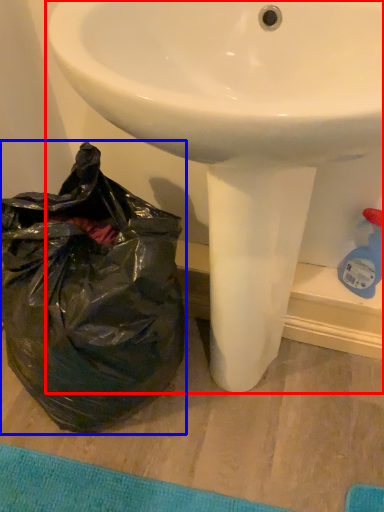
Question: Among these objects, which one is farthest to the camera, sink (highlighted by a red box) or plastic bag (highlighted by a blue box)?

Choices:
 (A) sink
 (B) plastic bag

Answer: (B)